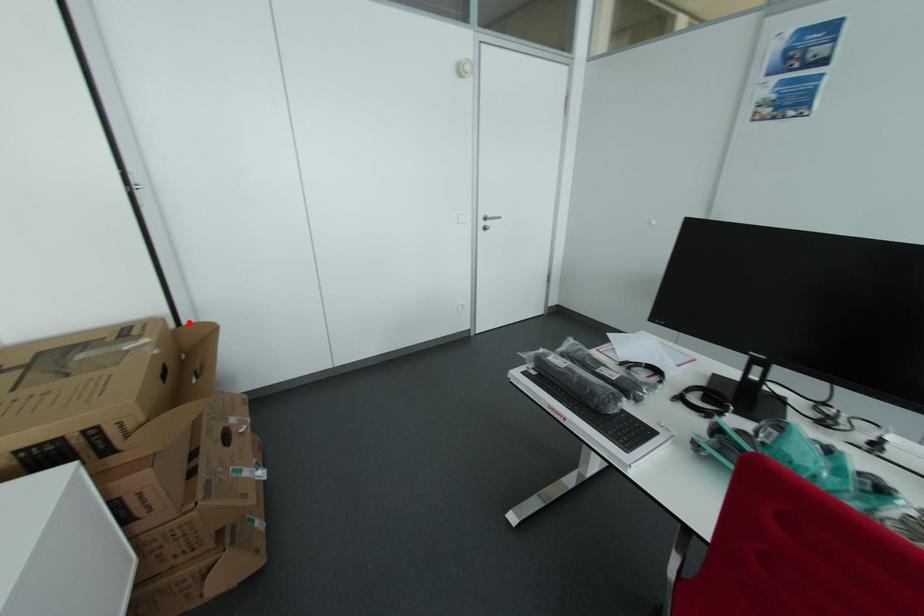
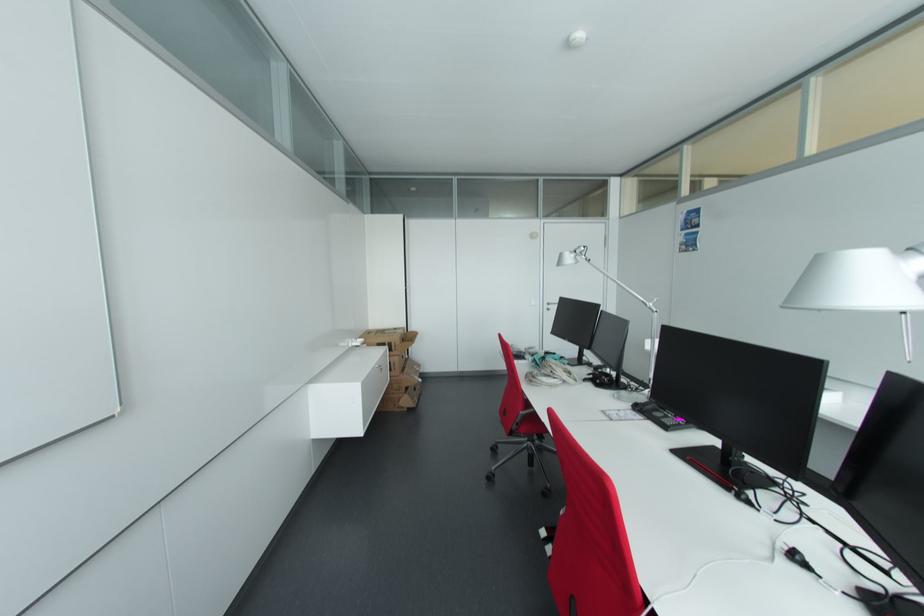
Find the pixel in the second image that matches the highlighted location in the first image.

(412, 331)